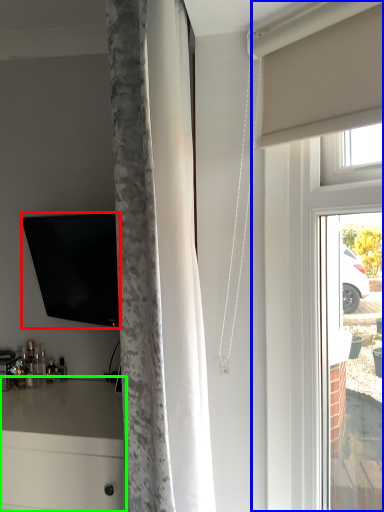
Question: Estimate the real-world distances between objects in this image. Which object is closer to television (highlighted by a red box), glass door (highlighted by a blue box) or counter (highlighted by a green box)?

Choices:
 (A) glass door
 (B) counter

Answer: (B)